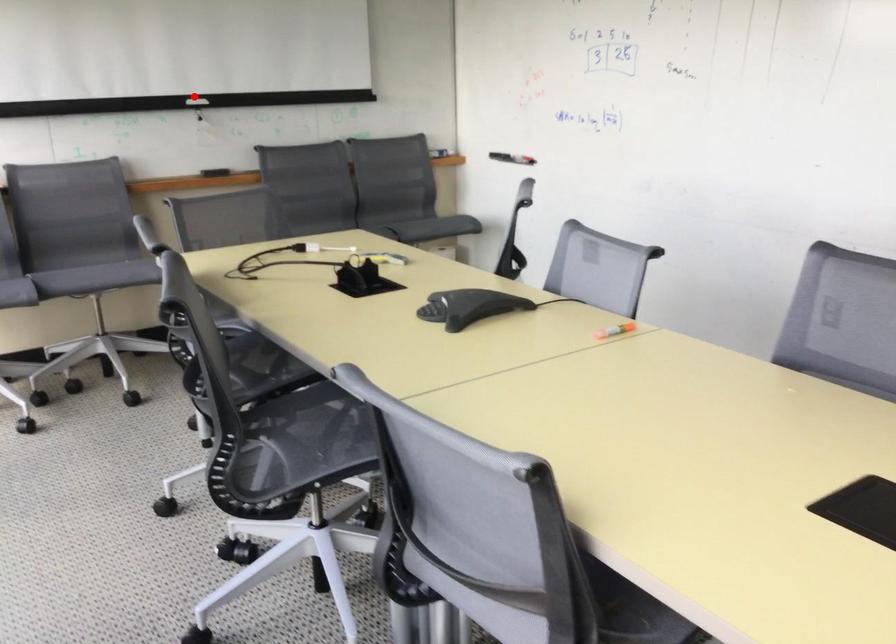
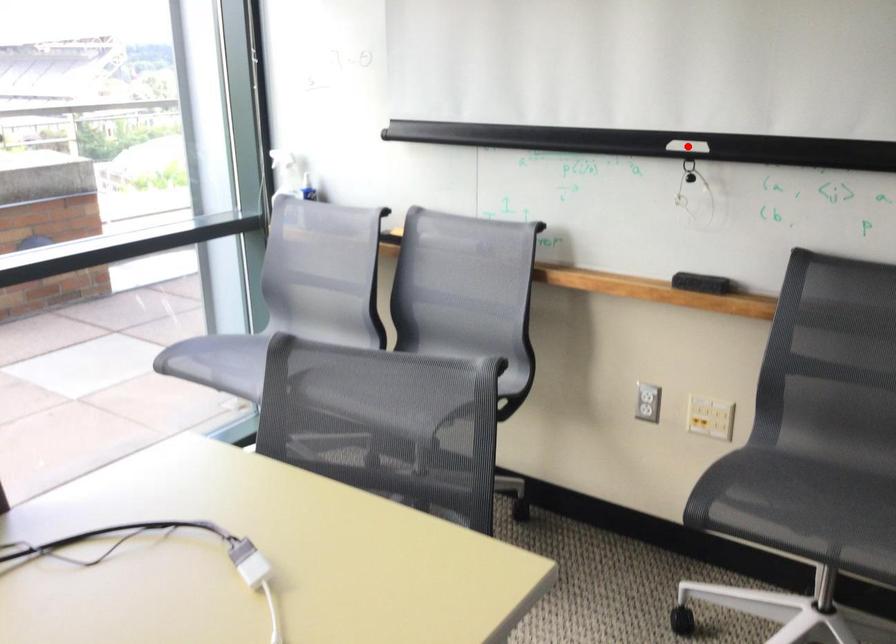
I am providing you with two images of the same scene from different viewpoints. A red point is marked on the first image and another point is marked on the second image. Is the marked point in image1 the same physical position as the marked point in image2?

Yes